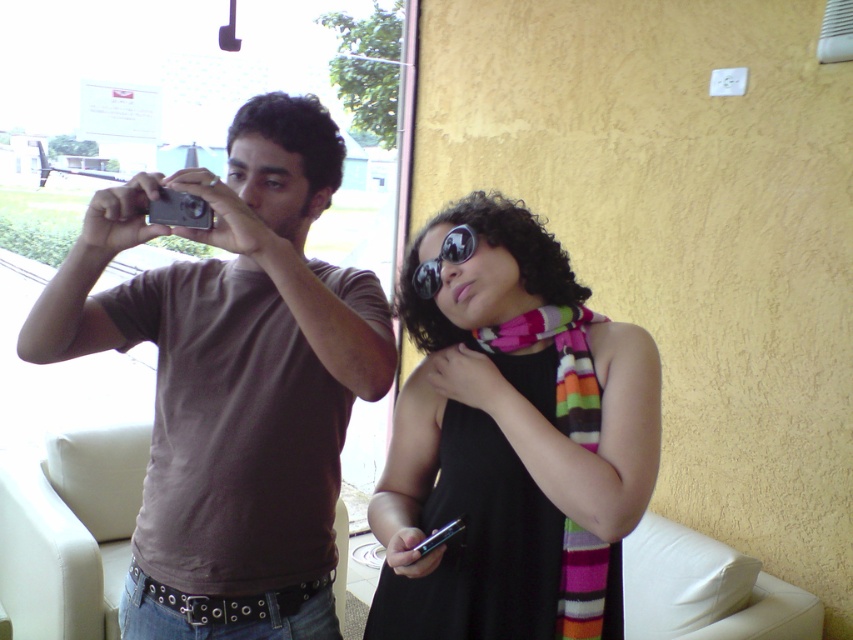
Which is more to the right, black reflective sunglasses at center or silver metallic camera at upper left?

black reflective sunglasses at center is more to the right.

Based on the photo, is black reflective sunglasses at center bigger than silver metallic camera at upper left?

Yes.

Does point (474, 232) come in front of point (161, 211)?

That is False.

In order to click on black reflective sunglasses at center in this screenshot , I will do `click(444, 259)`.

Between point (460, 298) and point (206, 220), which one is positioned behind?

The point (460, 298) is behind.

The image size is (853, 640). Find the location of `striped scarf at center`. striped scarf at center is located at coordinates coord(512,444).

In order to click on striped scarf at center in this screenshot , I will do `click(512, 444)`.

Does striped scarf at center appear over black reflective sunglasses at center?

No.

Does striped scarf at center appear under black reflective sunglasses at center?

Correct, striped scarf at center is located below black reflective sunglasses at center.

Does point (485, 317) lie in front of point (415, 275)?

That is True.

Image resolution: width=853 pixels, height=640 pixels. What are the coordinates of `striped scarf at center` in the screenshot? It's located at (512, 444).